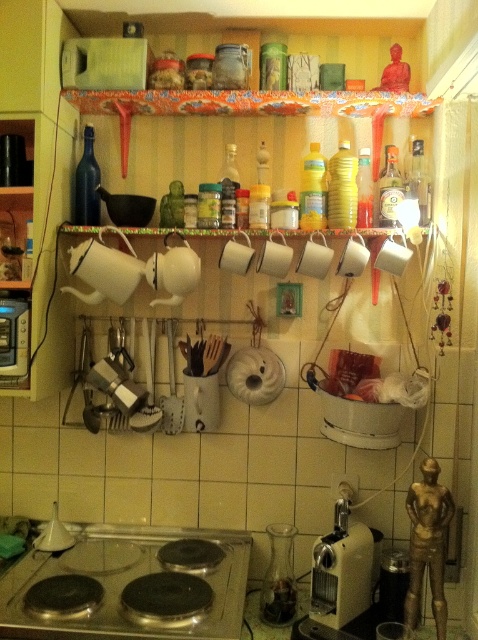
Question: Does black glass stove at lower center have a lesser width compared to metallic beige coffee machine at lower center?

Choices:
 (A) no
 (B) yes

Answer: (A)

Question: Which of the following is the closest to the observer?

Choices:
 (A) (0, 298)
 (B) (348, 598)
 (C) (86, 582)

Answer: (C)

Question: Where is black glass stove at lower center located in relation to metallic silver toaster at left in the image?

Choices:
 (A) right
 (B) left

Answer: (A)

Question: Which is farther from the metallic beige coffee machine at lower center?

Choices:
 (A) metallic silver toaster at left
 (B) black glass stove at lower center

Answer: (A)

Question: Estimate the real-world distances between objects in this image. Which object is farther from the black glass stove at lower center?

Choices:
 (A) metallic beige coffee machine at lower center
 (B) metallic silver toaster at left

Answer: (B)

Question: Does black glass stove at lower center have a smaller size compared to metallic silver toaster at left?

Choices:
 (A) yes
 (B) no

Answer: (B)